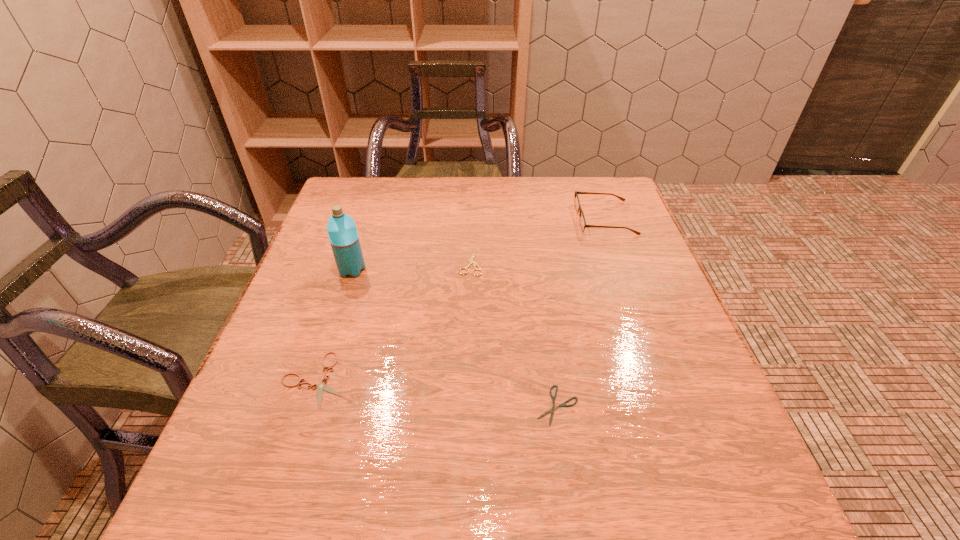
Locate an element on the screen. vacant position located 0.260m on the front-facing side of the spectacles is located at coordinates (480, 218).

Where is `free space located 0.390m on the front-facing side of the spectacles`? free space located 0.390m on the front-facing side of the spectacles is located at coordinates (431, 218).

Find the location of a particular element. vacant point located 0.210m on the front-facing side of the spectacles is located at coordinates (499, 218).

Locate an element on the screen. The image size is (960, 540). vacant space located on the back of the tallest shears is located at coordinates (472, 180).

Image resolution: width=960 pixels, height=540 pixels. In order to click on vacant space located 0.230m on the right of the fourth tallest object in this screenshot , I will do `click(473, 379)`.

The width and height of the screenshot is (960, 540). I want to click on vacant space located 0.240m on the left of the shortest object, so click(396, 406).

The height and width of the screenshot is (540, 960). I want to click on object present at the far edge, so click(x=583, y=225).

At what (x,y) coordinates should I click in order to perform the action: click on thermos bottle situated at the left edge. Please return your answer as a coordinate pair (x, y). This screenshot has height=540, width=960. Looking at the image, I should click on (343, 236).

Find the location of a particular element. This screenshot has width=960, height=540. shears situated at the left edge is located at coordinates (322, 386).

Locate an element on the screen. The width and height of the screenshot is (960, 540). object present at the right edge is located at coordinates (583, 225).